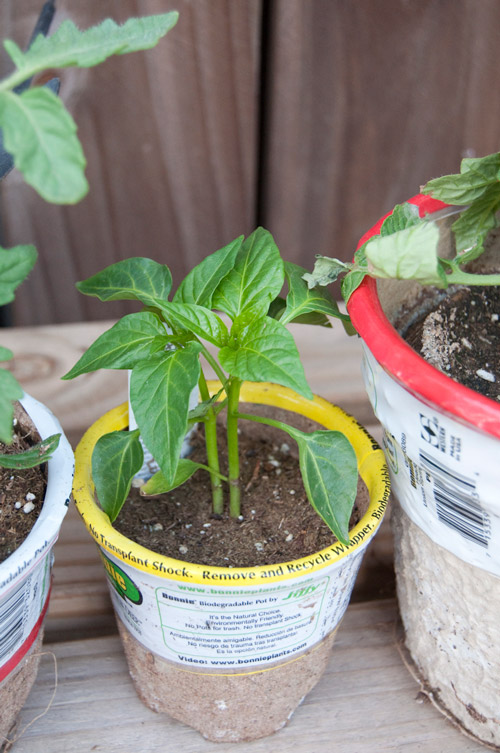
You are a GUI agent. You are given a task and a screenshot of the screen. Output one action in this format:
    pyautogui.click(x=<x>, y=<y>)
    Task: Click on the label of center planter
    This screenshot has width=500, height=753.
    Given the screenshot: What is the action you would take?
    pyautogui.click(x=125, y=581)